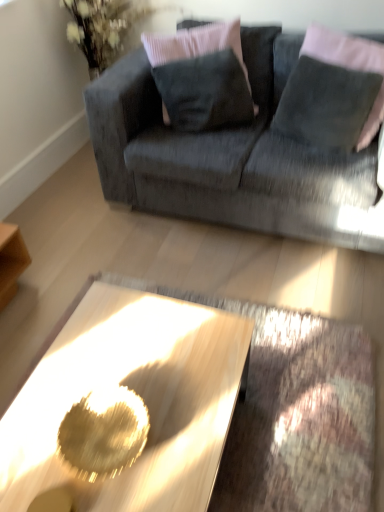
The image size is (384, 512). Identify the location of velvet gray couch at upper center. (231, 157).

This screenshot has height=512, width=384. What do you see at coordinates (136, 392) in the screenshot?
I see `metallic gold coffee table at center` at bounding box center [136, 392].

Where is `velvet gray couch at upper center`? velvet gray couch at upper center is located at coordinates (231, 157).

Considering the sizes of objects velvet gray couch at upper center and velvet dark gray pillow at upper center, which is the 1th pillow in left-to-right order, in the image provided, who is bigger, velvet gray couch at upper center or velvet dark gray pillow at upper center, which is the 1th pillow in left-to-right order,?

velvet gray couch at upper center.

Are velvet gray couch at upper center and velvet dark gray pillow at upper center, which is the 1th pillow in left-to-right order, beside each other?

No, velvet gray couch at upper center is not making contact with velvet dark gray pillow at upper center, which is the 1th pillow in left-to-right order.

Is velvet gray couch at upper center at the left side of velvet dark gray pillow at upper center, which is counted as the 2th pillow, starting from the right?

Incorrect, velvet gray couch at upper center is not on the left side of velvet dark gray pillow at upper center, which is counted as the 2th pillow, starting from the right.

From a real-world perspective, is velvet gray couch at upper center beneath velvet dark gray pillow at upper center, which is the 1th pillow in left-to-right order?

Yes, from a real-world perspective, velvet gray couch at upper center is below velvet dark gray pillow at upper center, which is the 1th pillow in left-to-right order.

Is point (247, 349) less distant than point (182, 63)?

Yes, it is.

From the image's perspective, is metallic gold coffee table at center above or below velvet dark gray pillow at upper center, which is counted as the 2th pillow, starting from the right?

Clearly, from the image's perspective, metallic gold coffee table at center is below velvet dark gray pillow at upper center, which is counted as the 2th pillow, starting from the right.

From a real-world perspective, is metallic gold coffee table at center positioned above or below velvet dark gray pillow at upper center, which is the 1th pillow in left-to-right order?

Clearly, from a real-world perspective, metallic gold coffee table at center is below velvet dark gray pillow at upper center, which is the 1th pillow in left-to-right order.

Can you tell me how much metallic gold coffee table at center and velvet dark gray pillow at upper center, which is the 1th pillow in left-to-right order, differ in facing direction?

There is a 125-degree angle between the facing directions of metallic gold coffee table at center and velvet dark gray pillow at upper center, which is the 1th pillow in left-to-right order.

Is velvet dark gray pillow at upper center, which is counted as the 2th pillow, starting from the right, at the back of velvet gray pillow at upper right, which is the second pillow in left-to-right order?

velvet gray pillow at upper right, which is the second pillow in left-to-right order, does not have its back to velvet dark gray pillow at upper center, which is counted as the 2th pillow, starting from the right.

Based on the photo, which object is thinner, velvet gray pillow at upper right, which is the second pillow in left-to-right order, or velvet dark gray pillow at upper center, which is counted as the 2th pillow, starting from the right?

velvet gray pillow at upper right, which is the second pillow in left-to-right order.

At what (x,y) coordinates should I click in order to perform the action: click on pillow on the right of velvet dark gray pillow at upper center, which is counted as the 2th pillow, starting from the right. Please return your answer as a coordinate pair (x, y). The image size is (384, 512). Looking at the image, I should click on (330, 91).

Which object is positioned more to the right, velvet gray pillow at upper right, which appears as the 1th pillow when viewed from the right, or velvet dark gray pillow at upper center, which is counted as the 2th pillow, starting from the right?

velvet gray pillow at upper right, which appears as the 1th pillow when viewed from the right, is more to the right.

From the picture: From a real-world perspective, between metallic gold coffee table at center and velvet gray pillow at upper right, which is the second pillow in left-to-right order, who is vertically higher?

velvet gray pillow at upper right, which is the second pillow in left-to-right order.

Would you say metallic gold coffee table at center is to the left or to the right of velvet gray pillow at upper right, which appears as the 1th pillow when viewed from the right, in the picture?

metallic gold coffee table at center is positioned on velvet gray pillow at upper right, which appears as the 1th pillow when viewed from the right,'s left side.

Which object is further away from the camera, metallic gold coffee table at center or velvet gray pillow at upper right, which is the second pillow in left-to-right order?

velvet gray pillow at upper right, which is the second pillow in left-to-right order, is more distant.

Locate an element on the screen. Image resolution: width=384 pixels, height=512 pixels. coffee table below the velvet gray pillow at upper right, which appears as the 1th pillow when viewed from the right (from the image's perspective) is located at coordinates (136, 392).

Can you confirm if velvet gray couch at upper center is wider than metallic gold coffee table at center?

Yes.

Visually, is velvet gray couch at upper center positioned to the left or to the right of metallic gold coffee table at center?

Clearly, velvet gray couch at upper center is on the right of metallic gold coffee table at center in the image.

From the image's perspective, is velvet gray couch at upper center located above metallic gold coffee table at center?

Yes.

From a real-world perspective, which object rests below the other?

metallic gold coffee table at center, from a real-world perspective.

Is velvet dark gray pillow at upper center, which is the 1th pillow in left-to-right order, at the left side of velvet gray couch at upper center?

Yes.

Is point (240, 63) positioned behind point (241, 142)?

Yes, point (240, 63) is farther from viewer.

Is velvet dark gray pillow at upper center, which is counted as the 2th pillow, starting from the right, positioned with its back to velvet gray couch at upper center?

That's right, velvet dark gray pillow at upper center, which is counted as the 2th pillow, starting from the right, is facing away from velvet gray couch at upper center.

From the image's perspective, which one is positioned lower, velvet dark gray pillow at upper center, which is the 1th pillow in left-to-right order, or velvet gray couch at upper center?

From the image's view, velvet gray couch at upper center is below.

From a real-world perspective, is velvet gray pillow at upper right, which appears as the 1th pillow when viewed from the right, physically located above or below velvet gray couch at upper center?

velvet gray pillow at upper right, which appears as the 1th pillow when viewed from the right, is above velvet gray couch at upper center.

From their relative heights in the image, would you say velvet gray pillow at upper right, which appears as the 1th pillow when viewed from the right, is taller or shorter than velvet gray couch at upper center?

Clearly, velvet gray pillow at upper right, which appears as the 1th pillow when viewed from the right, is shorter compared to velvet gray couch at upper center.

Considering the relative sizes of velvet gray pillow at upper right, which is the second pillow in left-to-right order, and velvet gray couch at upper center in the image provided, is velvet gray pillow at upper right, which is the second pillow in left-to-right order, wider than velvet gray couch at upper center?

Incorrect, the width of velvet gray pillow at upper right, which is the second pillow in left-to-right order, does not surpass that of velvet gray couch at upper center.

In order to click on pillow on the right of velvet gray couch at upper center in this screenshot , I will do `click(330, 91)`.

The height and width of the screenshot is (512, 384). Find the location of `pillow to the left of velvet gray couch at upper center`. pillow to the left of velvet gray couch at upper center is located at coordinates (201, 77).

Locate an element on the screen. coffee table in front of the velvet dark gray pillow at upper center, which is the 1th pillow in left-to-right order is located at coordinates (136, 392).

When comparing their distances from metallic gold coffee table at center, does velvet gray couch at upper center or velvet gray pillow at upper right, which appears as the 1th pillow when viewed from the right, seem closer?

velvet gray couch at upper center lies closer to metallic gold coffee table at center than the other object.

Estimate the real-world distances between objects in this image. Which object is closer to velvet dark gray pillow at upper center, which is counted as the 2th pillow, starting from the right, metallic gold coffee table at center or velvet gray pillow at upper right, which appears as the 1th pillow when viewed from the right?

velvet gray pillow at upper right, which appears as the 1th pillow when viewed from the right, is positioned closer to the anchor velvet dark gray pillow at upper center, which is counted as the 2th pillow, starting from the right.

Based on their spatial positions, is velvet dark gray pillow at upper center, which is the 1th pillow in left-to-right order, or velvet gray couch at upper center further from velvet gray pillow at upper right, which is the second pillow in left-to-right order?

velvet dark gray pillow at upper center, which is the 1th pillow in left-to-right order.

Which object lies further to the anchor point velvet dark gray pillow at upper center, which is the 1th pillow in left-to-right order, velvet gray pillow at upper right, which appears as the 1th pillow when viewed from the right, or velvet gray couch at upper center?

The object further to velvet dark gray pillow at upper center, which is the 1th pillow in left-to-right order, is velvet gray pillow at upper right, which appears as the 1th pillow when viewed from the right.

Based on their spatial positions, is velvet gray couch at upper center or velvet dark gray pillow at upper center, which is counted as the 2th pillow, starting from the right, further from metallic gold coffee table at center?

velvet dark gray pillow at upper center, which is counted as the 2th pillow, starting from the right.

Based on their spatial positions, is velvet dark gray pillow at upper center, which is counted as the 2th pillow, starting from the right, or metallic gold coffee table at center closer to velvet gray couch at upper center?

velvet dark gray pillow at upper center, which is counted as the 2th pillow, starting from the right.

Which object lies nearer to the anchor point velvet gray couch at upper center, velvet gray pillow at upper right, which appears as the 1th pillow when viewed from the right, or velvet dark gray pillow at upper center, which is the 1th pillow in left-to-right order?

velvet dark gray pillow at upper center, which is the 1th pillow in left-to-right order, is positioned closer to the anchor velvet gray couch at upper center.

Looking at this image, considering their positions, is velvet gray couch at upper center positioned further to velvet dark gray pillow at upper center, which is counted as the 2th pillow, starting from the right, than velvet gray pillow at upper right, which is the second pillow in left-to-right order?

velvet gray pillow at upper right, which is the second pillow in left-to-right order, lies further to velvet dark gray pillow at upper center, which is counted as the 2th pillow, starting from the right, than the other object.

This screenshot has width=384, height=512. I want to click on studio couch between velvet gray pillow at upper right, which is the second pillow in left-to-right order, and metallic gold coffee table at center vertically, so click(x=231, y=157).

Locate an element on the screen. The width and height of the screenshot is (384, 512). pillow between velvet dark gray pillow at upper center, which is counted as the 2th pillow, starting from the right, and metallic gold coffee table at center from top to bottom is located at coordinates (330, 91).

Where is `studio couch situated between velvet dark gray pillow at upper center, which is the 1th pillow in left-to-right order, and velvet gray pillow at upper right, which appears as the 1th pillow when viewed from the right, from left to right`? This screenshot has width=384, height=512. studio couch situated between velvet dark gray pillow at upper center, which is the 1th pillow in left-to-right order, and velvet gray pillow at upper right, which appears as the 1th pillow when viewed from the right, from left to right is located at coordinates coord(231,157).

I want to click on studio couch between velvet dark gray pillow at upper center, which is counted as the 2th pillow, starting from the right, and metallic gold coffee table at center from top to bottom, so click(231, 157).